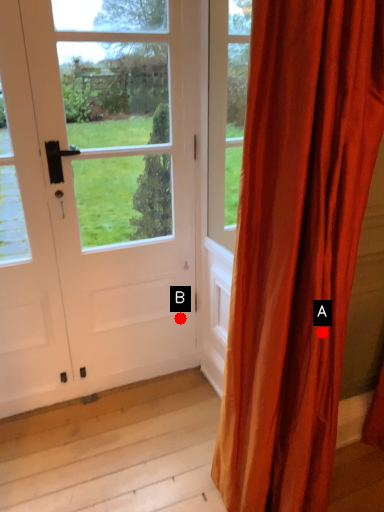
Question: Two points are circled on the image, labeled by A and B beside each circle. Which point appears farthest from the camera in this image?

Choices:
 (A) A is further
 (B) B is further

Answer: (B)